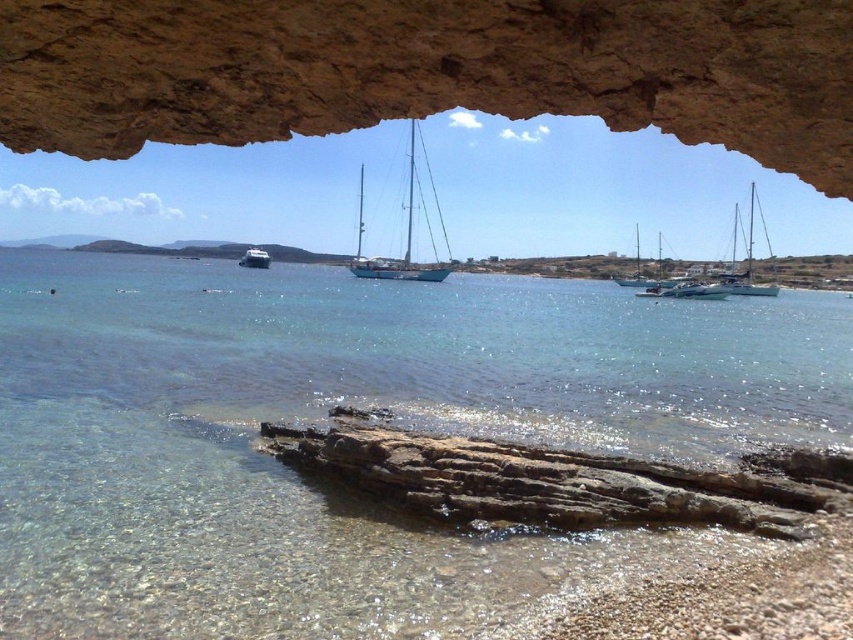
You are standing at the point marked as point (746, 256). What object is located at your current position?

The white glossy sailboat at right is located at point (746, 256).

You are planning to dock your boat at the center of the bay. There are two boats there currently. Which one has more space between its sides and the dock? The white matte sailboat at center and the white glossy boat at center are both present. Please choose the correct one.

The white matte sailboat at center has a larger width than the white glossy boat at center, so it has more space between its sides and the dock.

You are standing at the edge of the rocky shoreline and want to locate the white matte sailboat at center. According to the coordinates provided, in which direction should you look relative to your position?

The white matte sailboat at center is located at coordinates point (410, 225), which is in the middle of the image. Since you are at the edge of the rocky shoreline, you should look towards the center of the image to find it.